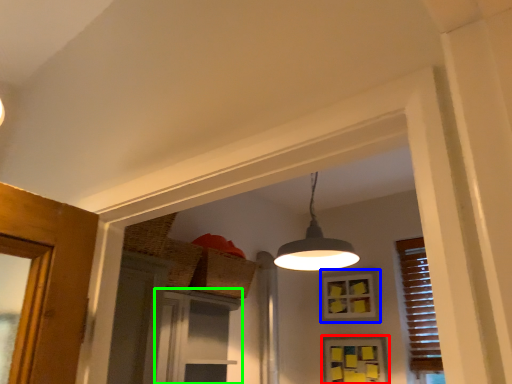
Question: Estimate the real-world distances between objects in this image. Which object is farther from window (highlighted by a red box), window (highlighted by a blue box) or screen door (highlighted by a green box)?

Choices:
 (A) window
 (B) screen door

Answer: (B)